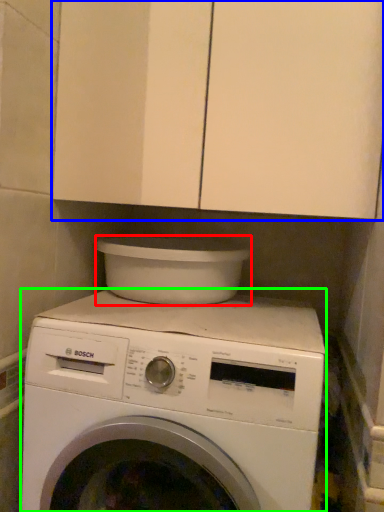
Question: Based on their relative distances, which object is nearer to appliance (highlighted by a red box)? Choose from cabinetry (highlighted by a blue box) and washing machine (highlighted by a green box).

Choices:
 (A) cabinetry
 (B) washing machine

Answer: (B)